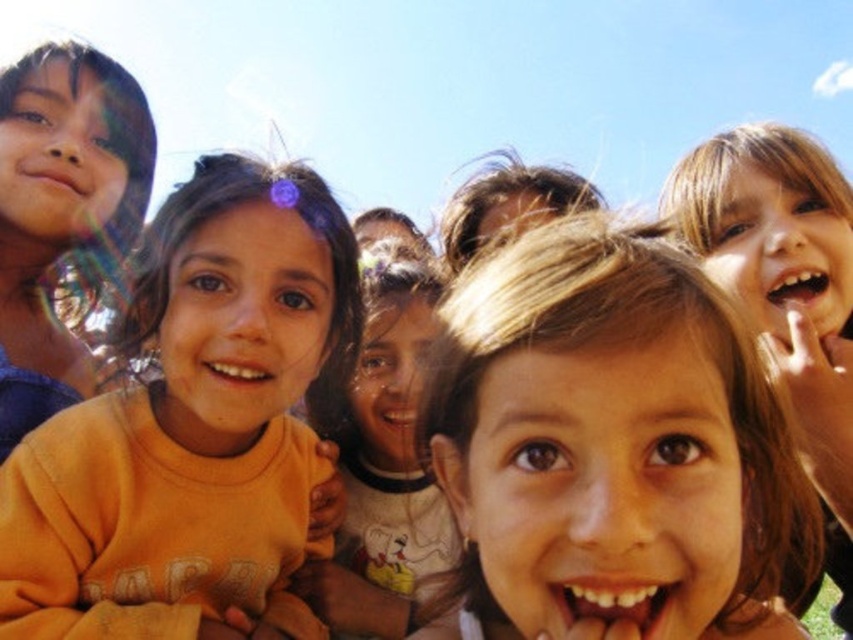
Based on the photo, you are a photographer trying to capture a closeup of the blonde hair at center and the orange cotton shirt at center. Since you can only focus on one object at a time, which one should you choose to ensure it appears larger in the photo?

The orange cotton shirt at center is larger than the blonde hair at center, so focusing on the orange cotton shirt at center would make it appear larger in the photo.

You are a photographer trying to capture a group shot of the children. You want to ensure that the child with the blonde hair at center and the child in the orange cotton shirt at center are both clearly visible. Based on their positions, which child should you adjust to the left to frame them better?

The blonde hair at center is positioned on the right side of orange cotton shirt at center. To frame them better, you should adjust the child with the blonde hair at center to the left so that they are aligned properly with the orange cotton shirt at center.

You are a photographer trying to capture a group shot of the children. You notice the blonde hair at center and the orange cotton shirt at center are 29.03 inches apart. If your camera has a minimum focus distance of 30 inches, will you be able to focus on both subjects clearly?

The blonde hair at center and orange cotton shirt at center are 29.03 inches apart, which is less than the camera minimum focus distance of 30 inches. Therefore, the camera cannot focus on both subjects clearly.